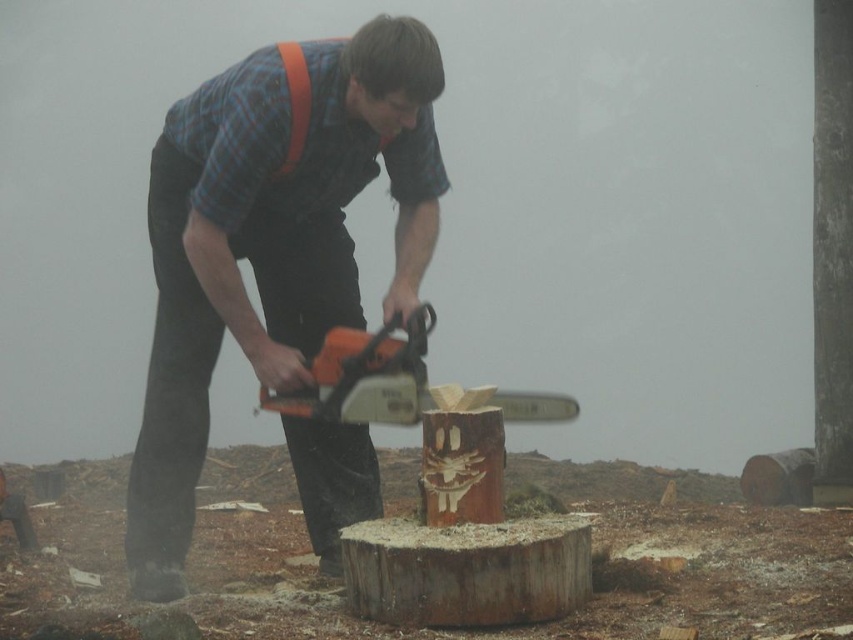
You are a photographer standing at the camera position. You want to take a closeup photo of the orange matte chainsaw at center. The camera can focus on objects within 4 meters. Will the chainsaw be in focus?

The orange matte chainsaw at center is 4.12 meters from camera, which is beyond the camera focus range of 4 meters. Therefore, the chainsaw will not be in focus.

Based on the scene description, where is the point at coordinates (466, 570) located?

The point at coordinates (466, 570) corresponds to the rustic wood carving at center.

You are standing in the wooded area and see two points marked in the image. Which point, point (234, 138) or point (306, 72), is closer to you?

Point (234, 138) is closer to the viewer than point (306, 72).